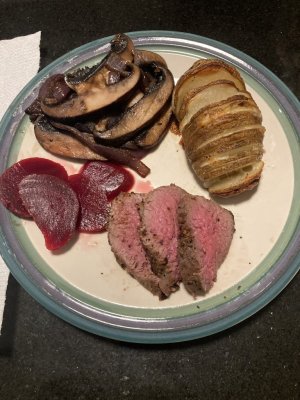
At what (x,y) coordinates should I click in order to perform the action: click on plate. Please return your answer as a coordinate pair (x, y). Looking at the image, I should click on (169, 161).